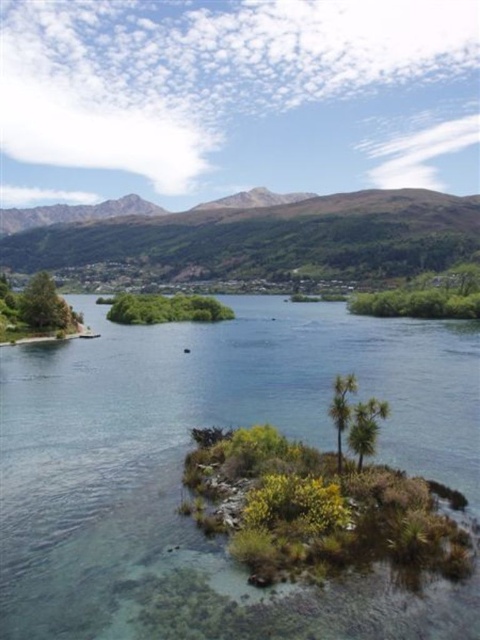
You are an aerial photographer planning to capture the green forested mountain at upper center in your shot. The camera you are using has a rectangular frame with a 4x3 aspect ratio. If the mountain is located at coordinates approximately 0.377 on the x and 0.548 on the y, will it be positioned within the frame?

The green forested mountain at upper center is located at coordinates approximately 0.377 on the x and 0.548 on the y, so it will be positioned within the frame.

You are a bird flying over the landscape and want to land on the green leafy palm tree at center. Considering the clear water at center is larger than the tree, will you need to adjust your flight path to avoid the water?

The clear water at center is larger in size than the green leafy palm tree at center, so yes, you will need to adjust your flight path to avoid landing in the water instead of the tree.